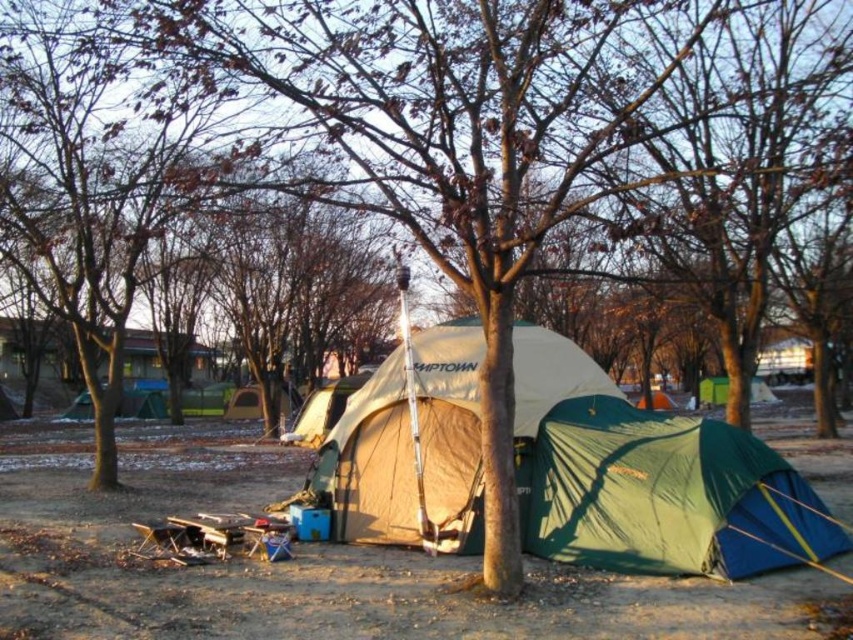
Question: Which point is closer to the camera?

Choices:
 (A) (432, 390)
 (B) (699, 422)

Answer: (B)

Question: Is green fabric tent at lower right to the right of beige fabric tent at center from the viewer's perspective?

Choices:
 (A) no
 (B) yes

Answer: (B)

Question: Is the position of green fabric tent at lower right more distant than that of beige fabric tent at center?

Choices:
 (A) no
 (B) yes

Answer: (A)

Question: Among these objects, which one is farthest from the camera?

Choices:
 (A) beige fabric tent at center
 (B) green fabric tent at lower right

Answer: (A)

Question: Which point is closer to the camera taking this photo?

Choices:
 (A) (589, 497)
 (B) (357, 504)

Answer: (A)

Question: Can you confirm if green fabric tent at lower right is positioned below beige fabric tent at center?

Choices:
 (A) yes
 (B) no

Answer: (A)